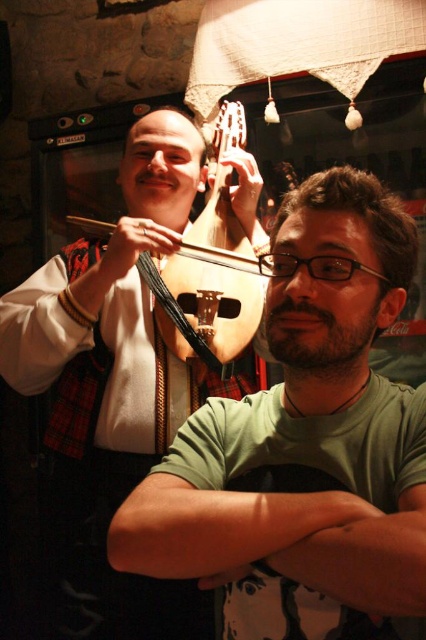
You are a musician who needs to choose an instrument to carry for a performance. You have to carry it through a narrow doorway that is 1 meter wide. Which instrument between the matte black guitar at left and the wooden cello at upper center do you think will fit better through the doorway?

The wooden cello at upper center is smaller than the matte black guitar at left, so it will fit better through the 1 meter wide doorway.

You are a photographer setting up a shoot in this scene. You need to ensure that the green matte shirt at center and the wooden cello at upper center are both in focus. Given their sizes, which object should you adjust your camera settings to prioritize focusing on first?

The green matte shirt at center is larger in size than the wooden cello at upper center. Since larger objects may require more precise focus adjustments, you should prioritize focusing on the green matte shirt at center first to ensure clarity.